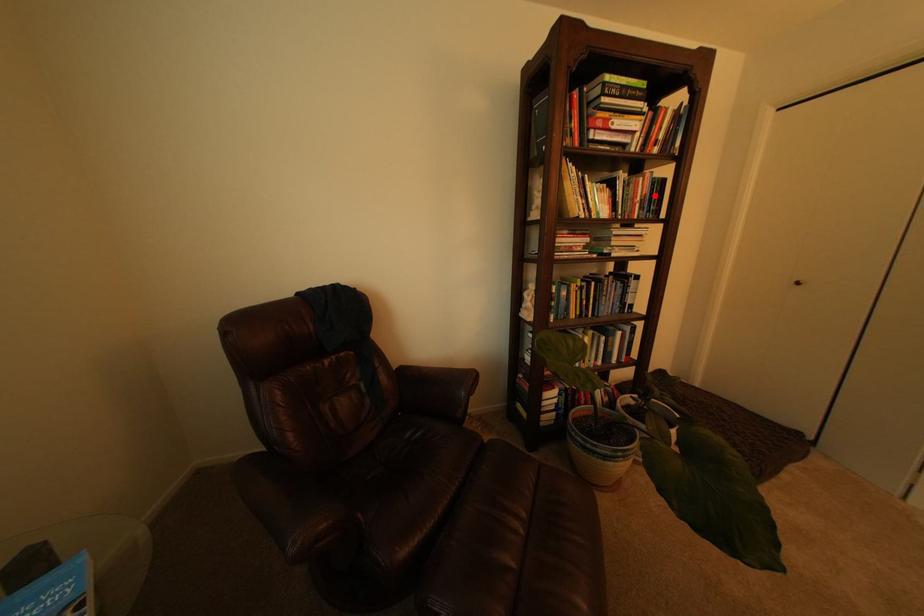
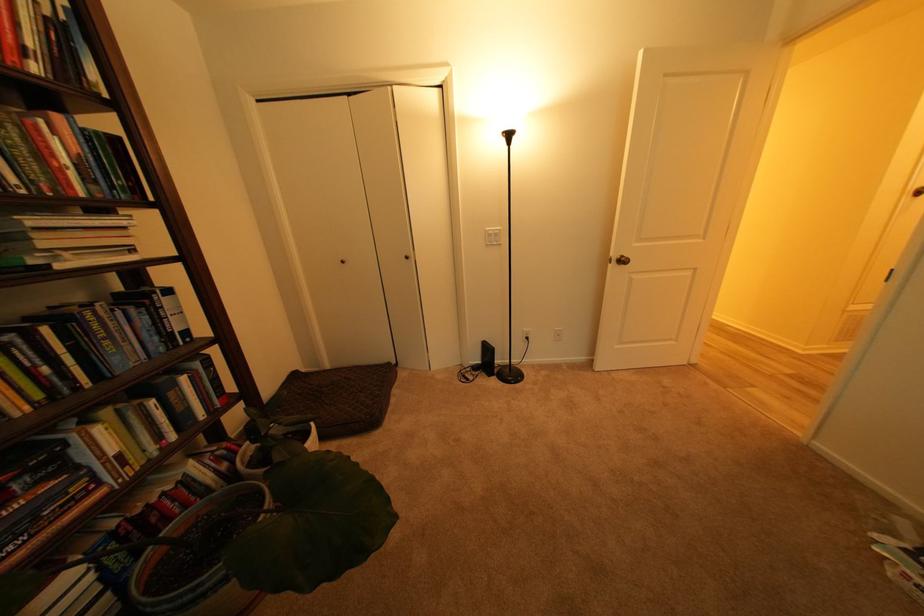
Locate, in the second image, the point that corresponds to the highlighted location in the first image.

(84, 156)